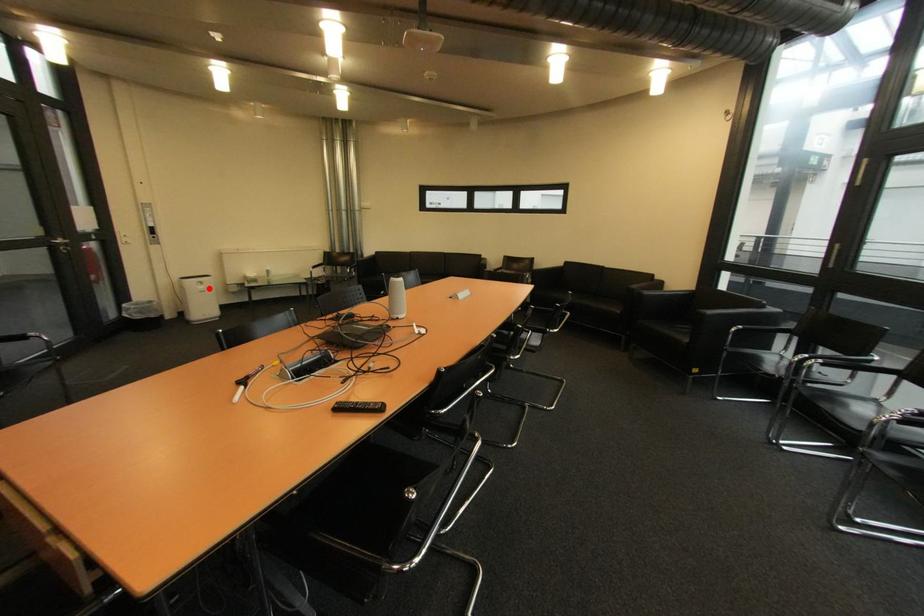
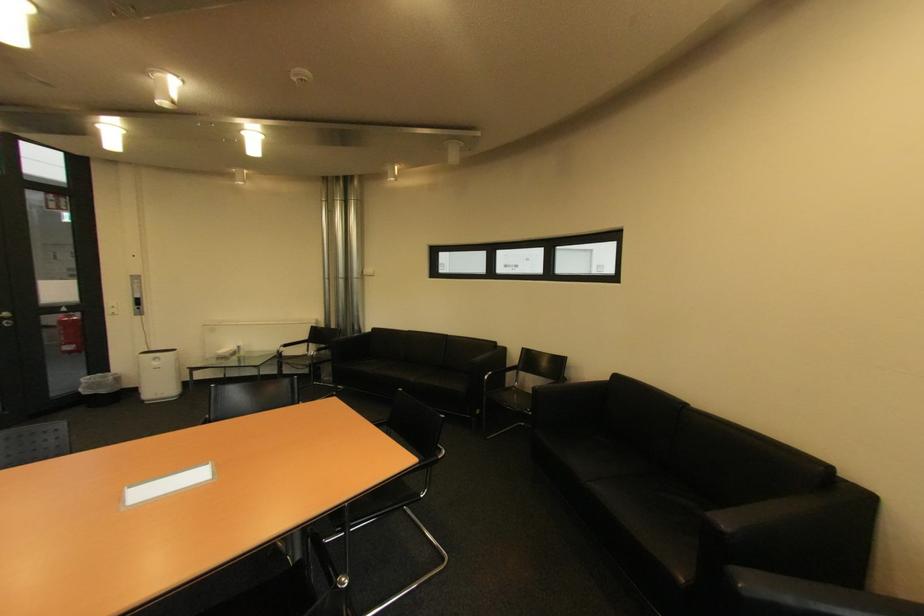
Question: I am providing you with two images of the same scene from different viewpoints. A red point is shown in image1. For the corresponding object point in image2, is it positioned nearer or farther from the camera?

Choices:
 (A) Nearer
 (B) Farther

Answer: (B)